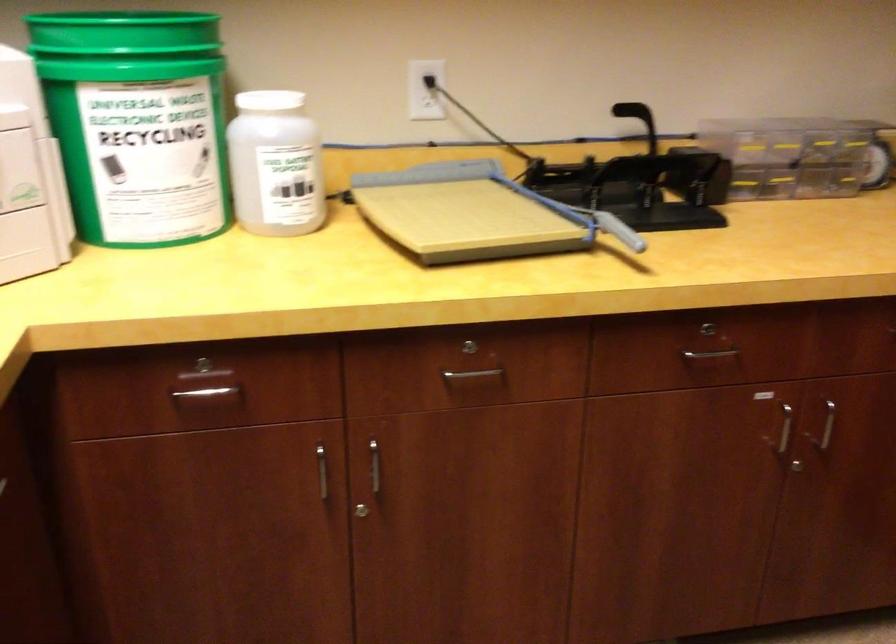
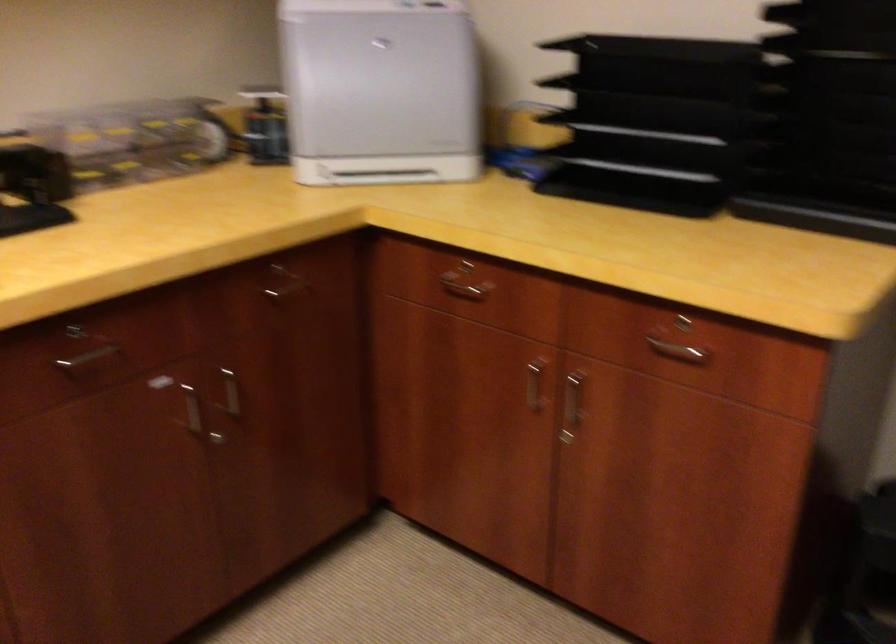
Locate, in the second image, the point that corresponds to pixel 778 435 in the first image.

(192, 408)